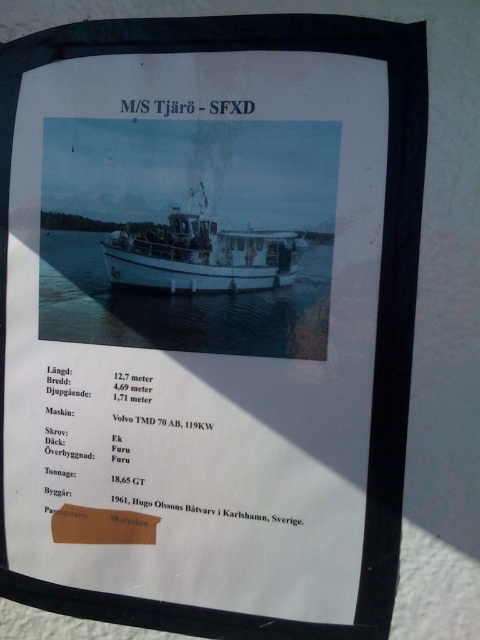
Does clear blue water at center have a lesser height compared to white matte boat at center?

Incorrect, clear blue water at center's height does not fall short of white matte boat at center's.

Between point (313, 275) and point (119, 248), which one is positioned behind?

The point (119, 248) is behind.

This screenshot has width=480, height=640. I want to click on clear blue water at center, so click(180, 307).